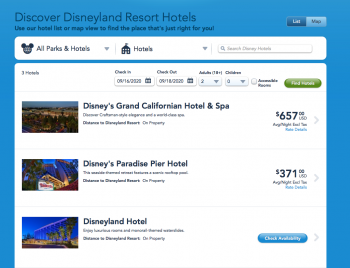
In order to click on hotels in this screenshot , I will do `click(176, 15)`.